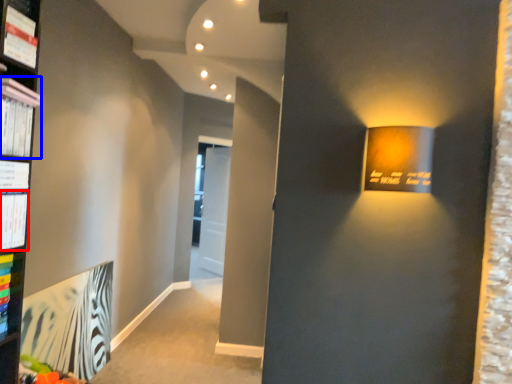
Question: Among these objects, which one is farthest to the camera, paperback book (highlighted by a red box) or magazine (highlighted by a blue box)?

Choices:
 (A) paperback book
 (B) magazine

Answer: (A)